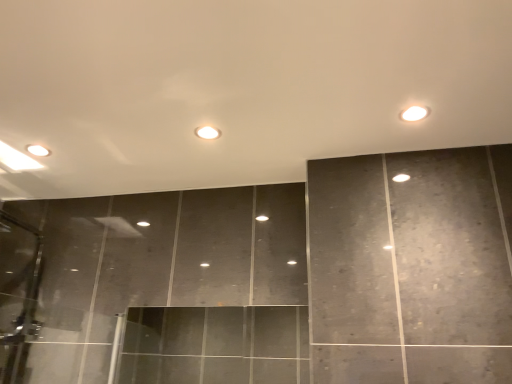
Question: Is white glossy light at center, placed as the first light when sorted from back to front, far from white glossy light at upper right, which is counted as the 2th light, starting from the left?

Choices:
 (A) no
 (B) yes

Answer: (A)

Question: From a real-world perspective, is white glossy light at center, placed as the first light when sorted from back to front, located beneath white glossy light at upper right, which is the first light from right to left?

Choices:
 (A) no
 (B) yes

Answer: (A)

Question: Would you say white glossy light at center, acting as the 2th light starting from the front, contains white glossy light at upper right, which is the first light from right to left?

Choices:
 (A) yes
 (B) no

Answer: (B)

Question: Is white glossy light at center, which is counted as the 1th light, starting from the left, beside white glossy light at upper right, which is counted as the first light, starting from the front?

Choices:
 (A) yes
 (B) no

Answer: (B)

Question: Does white glossy light at center, placed as the first light when sorted from back to front, come in front of white glossy light at upper right, which is counted as the 2th light, starting from the left?

Choices:
 (A) no
 (B) yes

Answer: (A)

Question: Is white glossy light at center, placed as the first light when sorted from back to front, thinner than white glossy light at upper right, which is the second light in back-to-front order?

Choices:
 (A) yes
 (B) no

Answer: (B)

Question: Is white glossy light at upper right, which is the second light in back-to-front order, not within white glossy light at center, marked as the 2th light in a right-to-left arrangement?

Choices:
 (A) no
 (B) yes

Answer: (B)

Question: Can you confirm if white glossy light at upper right, which is the first light from right to left, is smaller than white glossy light at center, placed as the first light when sorted from back to front?

Choices:
 (A) yes
 (B) no

Answer: (B)

Question: Is white glossy light at upper right, which is counted as the 2th light, starting from the left, in front of white glossy light at center, placed as the first light when sorted from back to front?

Choices:
 (A) yes
 (B) no

Answer: (A)

Question: Can you confirm if white glossy light at upper right, which is the second light in back-to-front order, is positioned to the right of white glossy light at center, marked as the 2th light in a right-to-left arrangement?

Choices:
 (A) no
 (B) yes

Answer: (B)

Question: From a real-world perspective, is white glossy light at upper right, which is counted as the first light, starting from the front, positioned under white glossy light at center, marked as the 2th light in a right-to-left arrangement, based on gravity?

Choices:
 (A) no
 (B) yes

Answer: (B)

Question: Can you confirm if white glossy light at upper right, which is the first light from right to left, is shorter than white glossy light at center, which is counted as the 1th light, starting from the left?

Choices:
 (A) no
 (B) yes

Answer: (A)

Question: In terms of width, does white glossy light at center, marked as the 2th light in a right-to-left arrangement, look wider or thinner when compared to white glossy light at upper right, which is the second light in back-to-front order?

Choices:
 (A) thin
 (B) wide

Answer: (B)